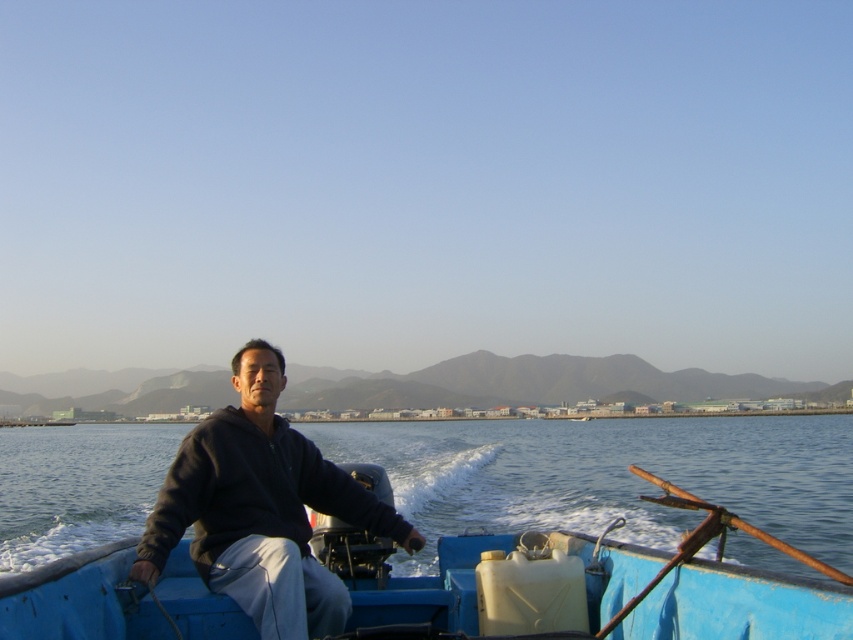
You are a photographer trying to capture the blue water at center and the dark blue sweatshirt at center in a single shot. Which object should you focus on first if you want to ensure both are in frame without moving the camera?

Since the blue water at center is larger in size than the dark blue sweatshirt at center, you should focus on the blue water at center first to ensure both fit within the frame.

You are a passenger on the small blue boat and want to move from the back to the front. The boat has a white fuel container and a metal rod at the back. Considering the space between the blue water at center and the dark blue sweatshirt at center, can you safely walk past the equipment without stepping into the water?

The blue water at center is wider than the dark blue sweatshirt at center, so there is enough space to walk safely past the equipment without stepping into the water.